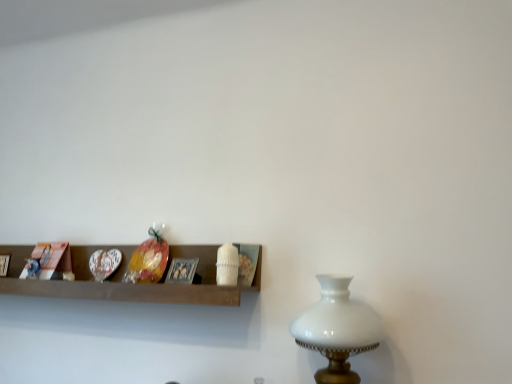
Question: From a real-world perspective, is wooden shelf at center under metallic silver picture frame at center?

Choices:
 (A) no
 (B) yes

Answer: (B)

Question: Can we say wooden shelf at center lies outside metallic silver picture frame at center?

Choices:
 (A) no
 (B) yes

Answer: (B)

Question: Is wooden shelf at center at the left side of metallic silver picture frame at center?

Choices:
 (A) no
 (B) yes

Answer: (B)

Question: Can metallic silver picture frame at center be found inside wooden shelf at center?

Choices:
 (A) no
 (B) yes

Answer: (B)

Question: Is wooden shelf at center positioned before metallic silver picture frame at center?

Choices:
 (A) no
 (B) yes

Answer: (B)

Question: Considering the relative sizes of wooden shelf at center and metallic silver picture frame at center in the image provided, is wooden shelf at center shorter than metallic silver picture frame at center?

Choices:
 (A) no
 (B) yes

Answer: (A)

Question: Can you confirm if white glass table lamp at right is positioned to the right of metallic silver picture frame at center?

Choices:
 (A) yes
 (B) no

Answer: (A)

Question: Is the position of white glass table lamp at right less distant than that of metallic silver picture frame at center?

Choices:
 (A) no
 (B) yes

Answer: (B)

Question: Does white glass table lamp at right contain metallic silver picture frame at center?

Choices:
 (A) yes
 (B) no

Answer: (B)

Question: Is white glass table lamp at right aimed at metallic silver picture frame at center?

Choices:
 (A) yes
 (B) no

Answer: (B)

Question: Is white glass table lamp at right touching metallic silver picture frame at center?

Choices:
 (A) yes
 (B) no

Answer: (B)

Question: Can you confirm if white glass table lamp at right is smaller than metallic silver picture frame at center?

Choices:
 (A) no
 (B) yes

Answer: (A)

Question: Is the position of wooden shelf at center more distant than that of white glass table lamp at right?

Choices:
 (A) yes
 (B) no

Answer: (A)